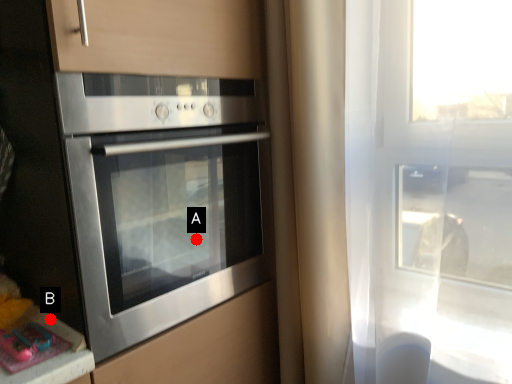
Question: Two points are circled on the image, labeled by A and B beside each circle. Among these points, which one is farthest from the camera?

Choices:
 (A) A is further
 (B) B is further

Answer: (A)